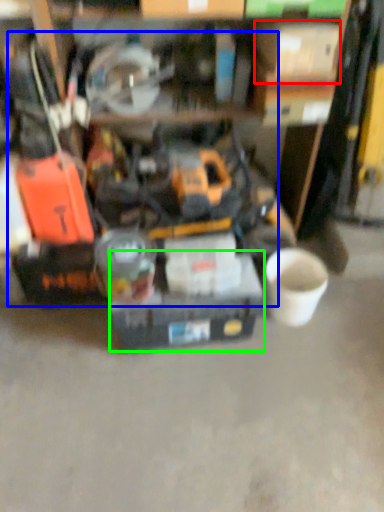
Question: Which is nearer to the box (highlighted by a red box)? tool (highlighted by a blue box) or box (highlighted by a green box).

Choices:
 (A) tool
 (B) box

Answer: (A)